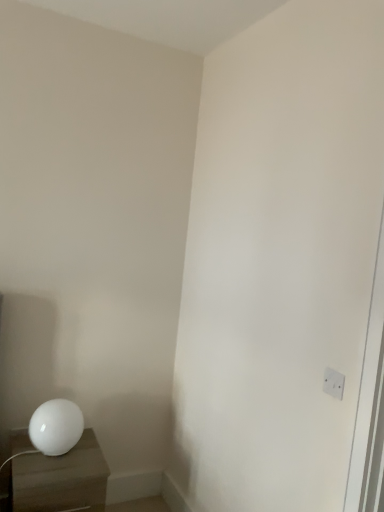
At what (x,y) coordinates should I click in order to perform the action: click on vacant area that lies in front of white glossy sphere at lower left. Please return your answer as a coordinate pair (x, y). Image resolution: width=384 pixels, height=512 pixels. Looking at the image, I should click on (41, 474).